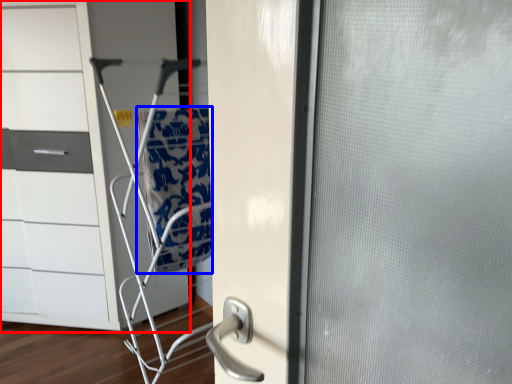
Question: Which point is closer to the camera, chest of drawers (highlighted by a red box) or blanket (highlighted by a blue box)?

Choices:
 (A) chest of drawers
 (B) blanket

Answer: (B)